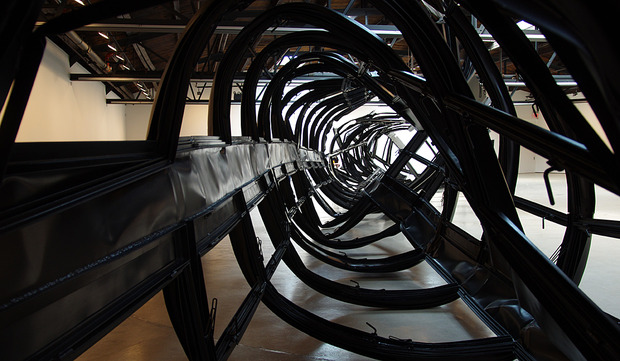
I want to click on back wall, so click(191, 124), click(523, 152).